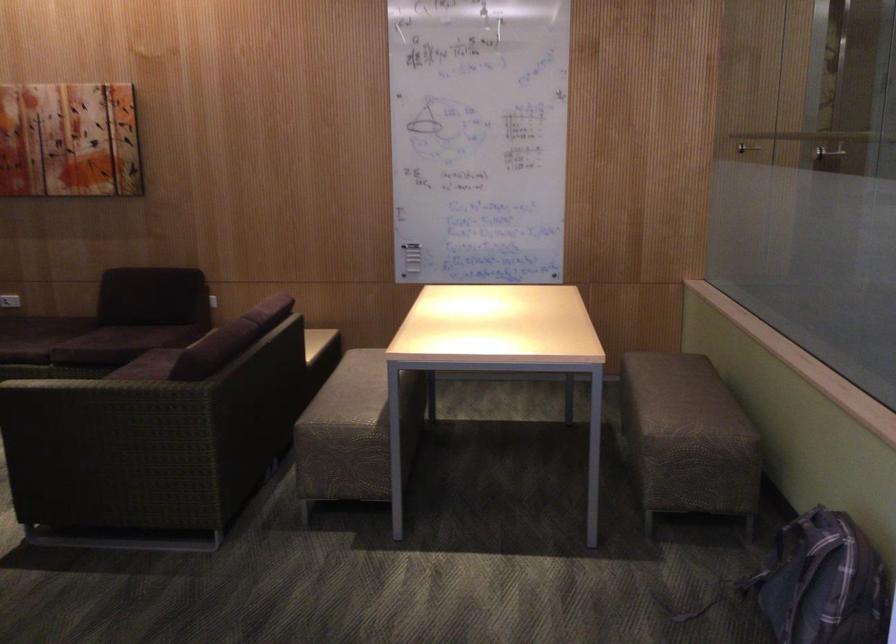
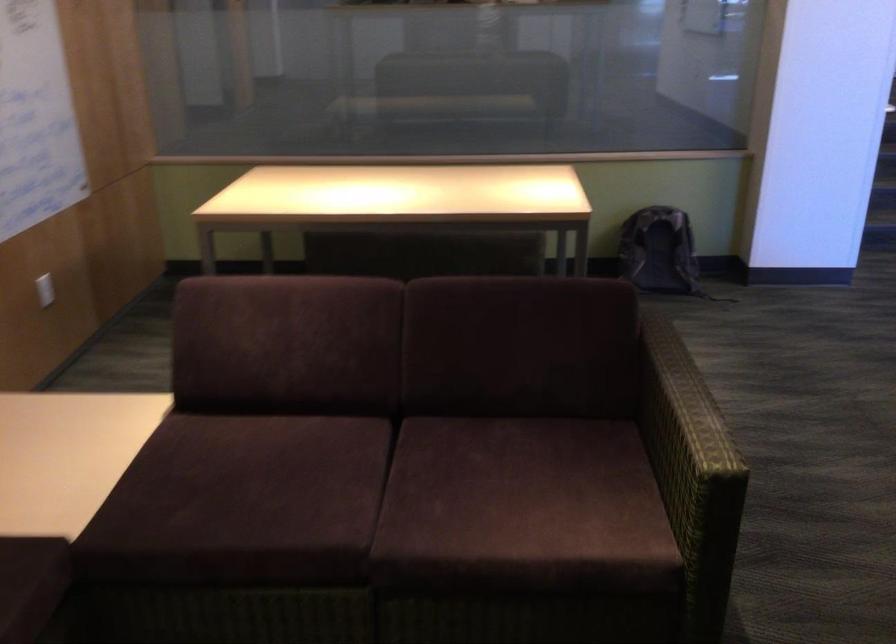
Locate, in the second image, the point that corresponds to point (820, 524) in the first image.

(660, 252)